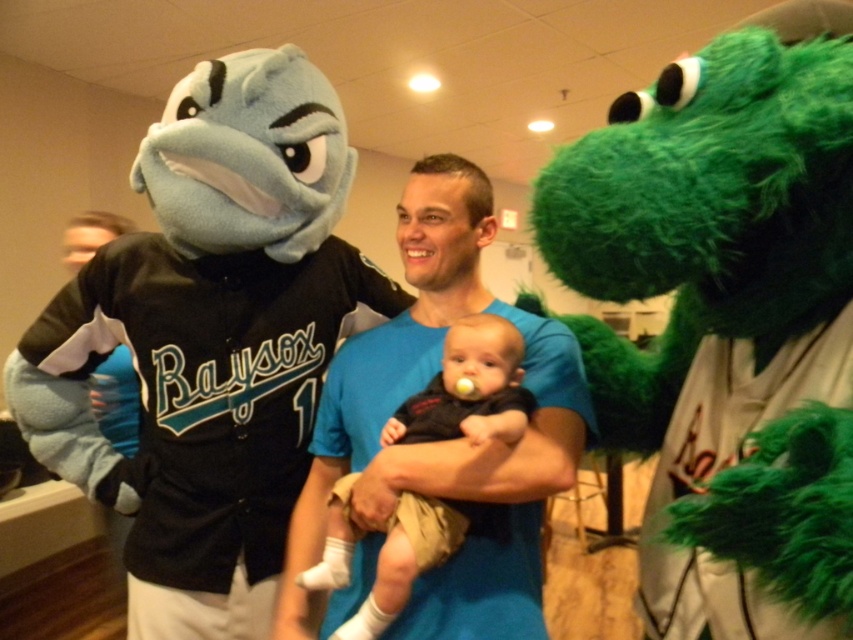
Question: Among these points, which one is farthest from the camera?

Choices:
 (A) (236, 371)
 (B) (732, 250)
 (C) (426, 548)

Answer: (A)

Question: Can you confirm if green furry creature at right is bigger than soft beige fabric baby at center?

Choices:
 (A) no
 (B) yes

Answer: (B)

Question: Which of the following is the closest to the observer?

Choices:
 (A) (728, 44)
 (B) (469, 372)

Answer: (A)

Question: Does green furry creature at right come behind soft beige fabric baby at center?

Choices:
 (A) yes
 (B) no

Answer: (B)

Question: Does blue cotton shirt at center have a smaller size compared to soft beige fabric baby at center?

Choices:
 (A) no
 (B) yes

Answer: (A)

Question: Which point is farther from the camera taking this photo?

Choices:
 (A) (393, 563)
 (B) (546, 388)
 (C) (277, 545)

Answer: (C)